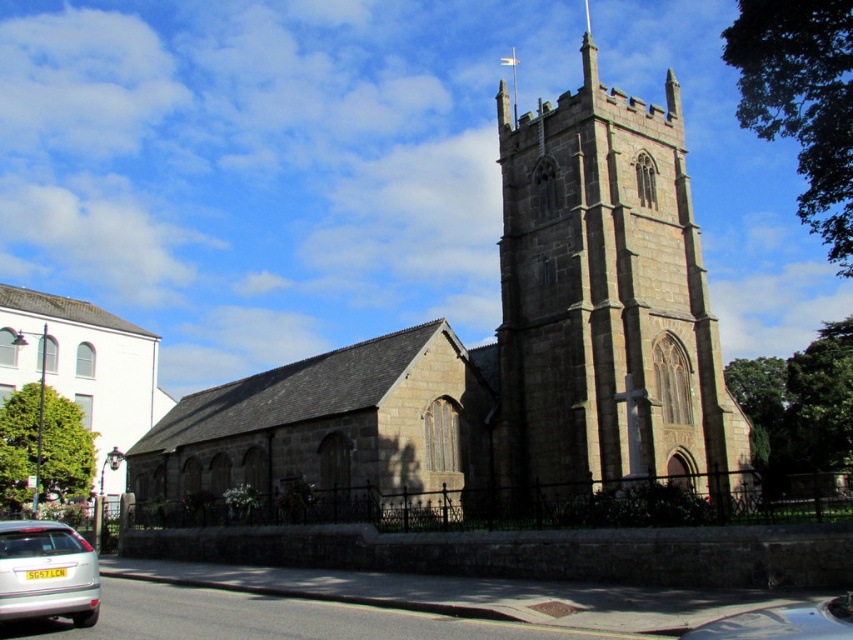
You are a drone operator planning to fly a drone over the historic stone church. The drone has a maximum flight width of 10 meters. You need to determine if the dark gray stone tower at center and the white smooth building at left can be captured in a single shot without exceeding the drone camera field of view. Which object is wider, and will the combined width of both fit within the drone camera field of view?

The dark gray stone tower at center might be wider than white smooth building at left. However, since the exact widths are not provided, it is uncertain if their combined width would fit within the 10 meters limit. Further measurements are required to confirm.

You are standing in front of the church and want to take a photo of both the dark gray stone tower at center and the white smooth building at left. Which one should you position closer to the camera to include both in the frame?

The dark gray stone tower at center is in front of the white smooth building at left, so you should position the camera closer to the tower to include both in the frame.

You are standing in front of the historic stone church and notice the white smooth building at left and the metallic silver car at lower right. Which object is wider?

The white smooth building at left is wider than the metallic silver car at lower right according to the description.